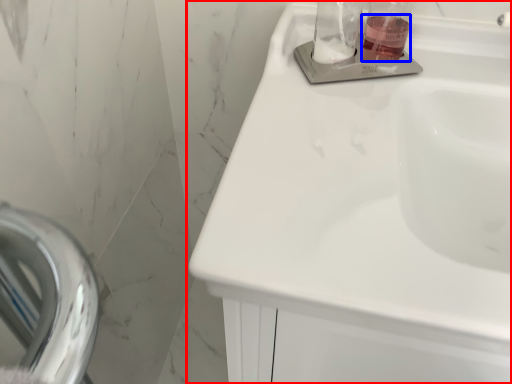
Question: Which object appears farthest to the camera in this image, sink (highlighted by a red box) or liquid (highlighted by a blue box)?

Choices:
 (A) sink
 (B) liquid

Answer: (B)